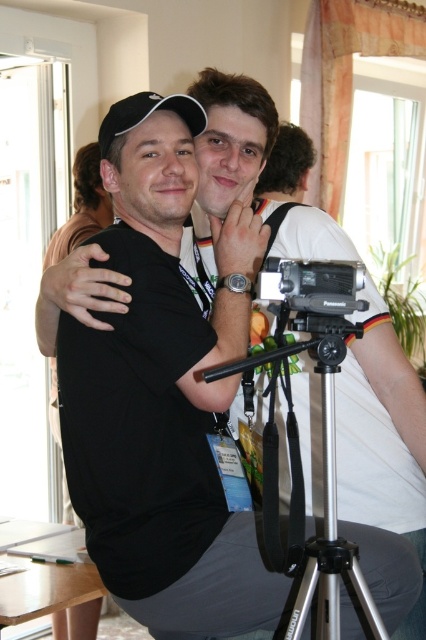
Question: Which object is closer to the camera taking this photo?

Choices:
 (A) silver metallic tripod at center
 (B) black plastic camera at center

Answer: (A)

Question: Which object is farther from the camera taking this photo?

Choices:
 (A) silver metallic tripod at center
 (B) black matte baseball cap at upper left
 (C) black plastic camera at center

Answer: (B)

Question: Can you confirm if black plastic camera at center is positioned to the left of black matte baseball cap at upper left?

Choices:
 (A) no
 (B) yes

Answer: (A)

Question: Can you confirm if silver metallic tripod at center is thinner than black matte baseball cap at upper left?

Choices:
 (A) yes
 (B) no

Answer: (B)

Question: Which object is farther from the camera taking this photo?

Choices:
 (A) silver metallic tripod at center
 (B) black matte baseball cap at upper left
 (C) black plastic camera at center

Answer: (B)

Question: Where is silver metallic tripod at center located in relation to black matte baseball cap at upper left in the image?

Choices:
 (A) left
 (B) right

Answer: (B)